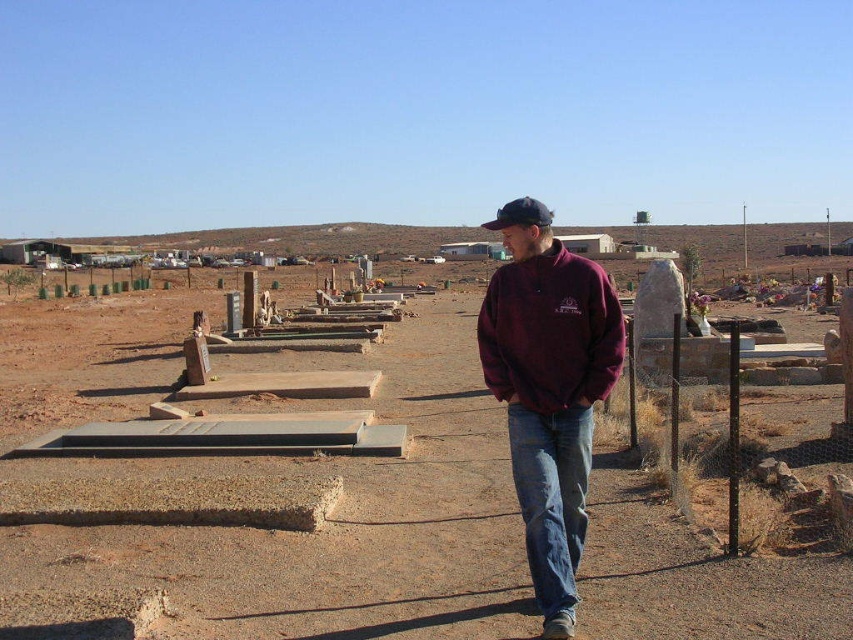
Identify the location of brown dirt field at center. Image resolution: width=853 pixels, height=640 pixels. (339, 522).

Between brown dirt field at center and maroon fleece jacket at center, which one has more height?

maroon fleece jacket at center

Is point (483, 416) closer to viewer compared to point (532, 278)?

That is False.

Where is `brown dirt field at center`? This screenshot has height=640, width=853. brown dirt field at center is located at coordinates (339, 522).

Can you confirm if maroon fleece jacket at center is thinner than maroon fleece sweatshirt at center?

In fact, maroon fleece jacket at center might be wider than maroon fleece sweatshirt at center.

Who is positioned more to the left, maroon fleece jacket at center or maroon fleece sweatshirt at center?

From the viewer's perspective, maroon fleece jacket at center appears more on the left side.

Who is more forward, [492,282] or [561,401]?

Point [561,401] is in front.

Find the location of a particular element. The height and width of the screenshot is (640, 853). maroon fleece jacket at center is located at coordinates (550, 396).

Does brown dirt field at center appear over maroon fleece sweatshirt at center?

Actually, brown dirt field at center is below maroon fleece sweatshirt at center.

Where is `brown dirt field at center`? This screenshot has width=853, height=640. brown dirt field at center is located at coordinates (339, 522).

Identify the location of brown dirt field at center. (339, 522).

Locate an element on the screen. brown dirt field at center is located at coordinates (339, 522).